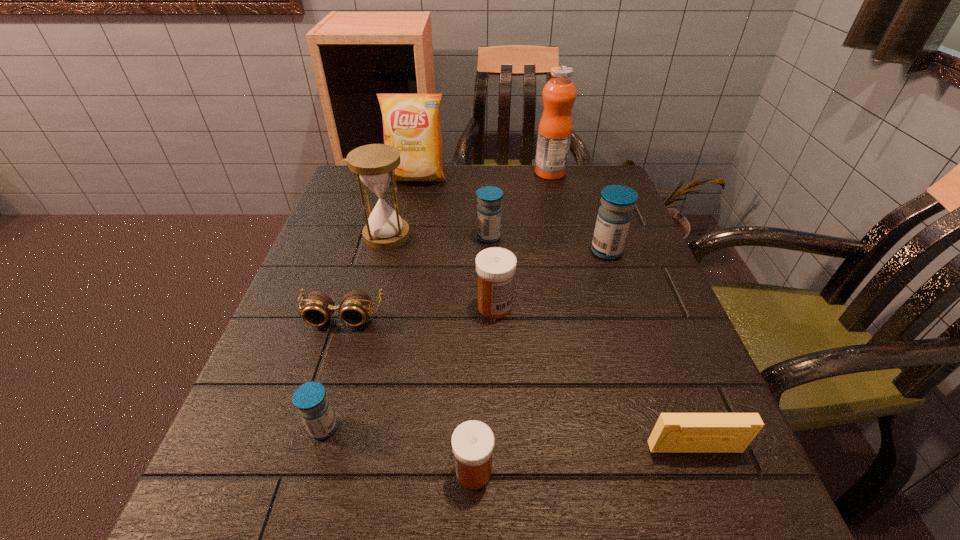
This screenshot has width=960, height=540. Find the location of `empty location between the videotape and the brown goggles`. empty location between the videotape and the brown goggles is located at coordinates (518, 382).

Select which object is the closest to the rightmost blue medicine. Please provide its 2D coordinates. Your answer should be formatted as a tuple, i.e. [(x, y)], where the tuple contains the x and y coordinates of a point satisfying the conditions above.

[(489, 209)]

Select which object is the closest to the crisp (potato chip). Please provide its 2D coordinates. Your answer should be formatted as a tuple, i.e. [(x, y)], where the tuple contains the x and y coordinates of a point satisfying the conditions above.

[(374, 164)]

Identify the location of medicine identified as the closest to the crisp (potato chip). (489, 209).

Identify the location of the closest medicine to the crisp (potato chip). This screenshot has width=960, height=540. (489, 209).

Select which blue medicine appears as the closest to the fruit juice. Please provide its 2D coordinates. Your answer should be formatted as a tuple, i.e. [(x, y)], where the tuple contains the x and y coordinates of a point satisfying the conditions above.

[(489, 209)]

At what (x,y) coordinates should I click in order to perform the action: click on blue medicine that is the second closest to the hourglass. Please return your answer as a coordinate pair (x, y). Image resolution: width=960 pixels, height=540 pixels. Looking at the image, I should click on (614, 216).

At what (x,y) coordinates should I click in order to perform the action: click on free space that satisfies the following two spatial constraints: 1. on the back side of the second biggest blue medicine; 2. on the right side of the tallest object. Please return your answer as a coordinate pair (x, y). The height and width of the screenshot is (540, 960). Looking at the image, I should click on (488, 173).

Where is `free point that satisfies the following two spatial constraints: 1. through the lenses of the goggles; 2. on the left side of the nearer white medicine`? The height and width of the screenshot is (540, 960). free point that satisfies the following two spatial constraints: 1. through the lenses of the goggles; 2. on the left side of the nearer white medicine is located at coordinates (292, 471).